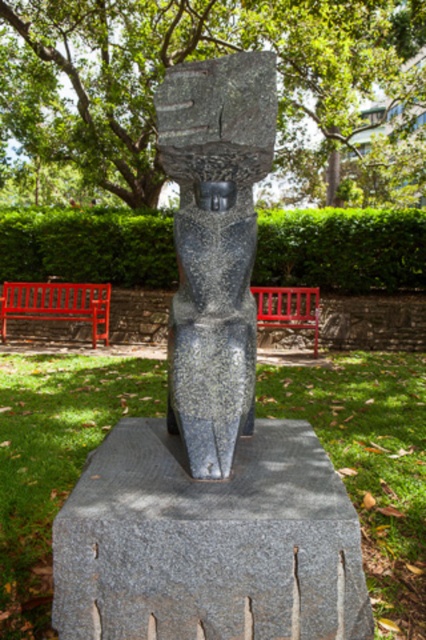
Question: Which object is the closest to the red painted wood bench at center?

Choices:
 (A) green leafy tree at upper center
 (B) red wooden bench at center
 (C) green leafy hedge at center

Answer: (C)

Question: Among these points, which one is farthest from the camera?

Choices:
 (A) (302, 296)
 (B) (121, 168)

Answer: (B)

Question: Which point is closer to the camera?

Choices:
 (A) red wooden bench at center
 (B) gray granite pedestal at center

Answer: (B)

Question: Is green leafy tree at upper center to the right of gray granite pedestal at center from the viewer's perspective?

Choices:
 (A) yes
 (B) no

Answer: (B)

Question: Can you confirm if green leafy tree at upper center is positioned below granite statue at center?

Choices:
 (A) no
 (B) yes

Answer: (A)

Question: Does green leafy tree at upper center have a lesser width compared to red wooden bench at center?

Choices:
 (A) no
 (B) yes

Answer: (A)